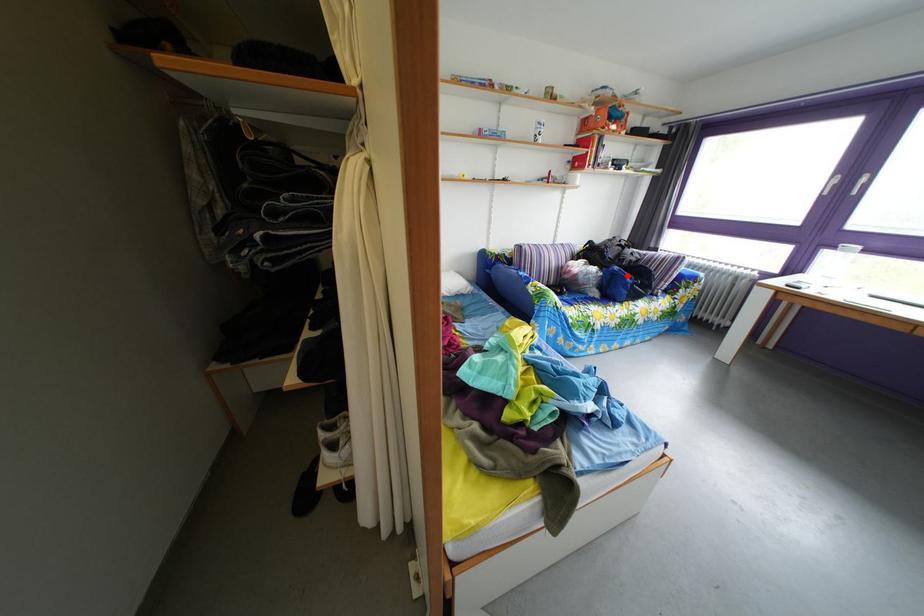
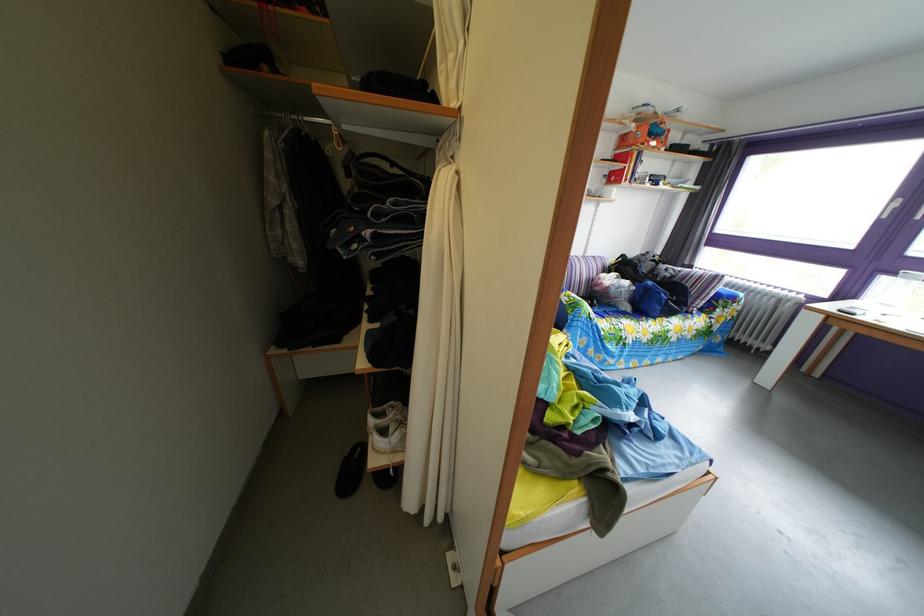
Locate, in the second image, the point that corresponds to the highlighted location in the first image.

(661, 291)